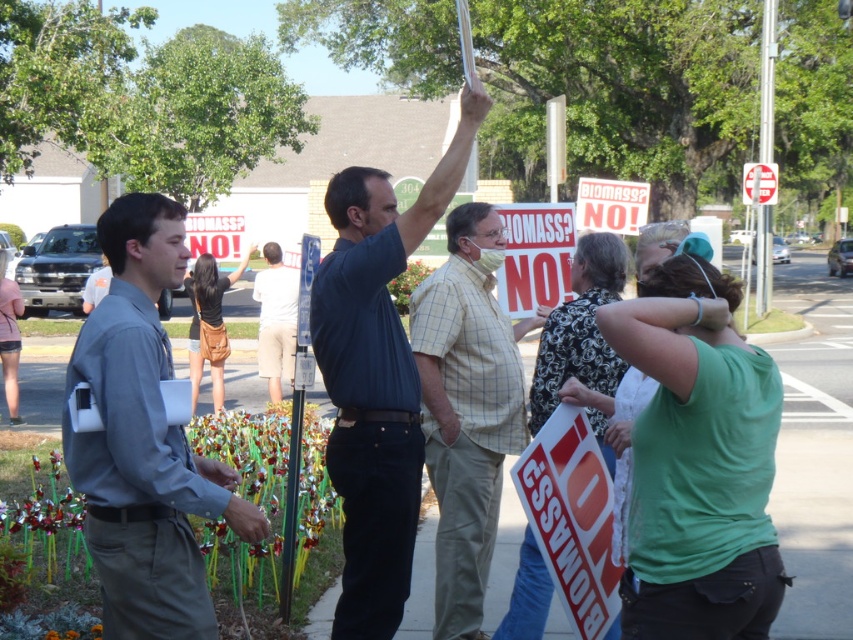
Between point (119, 380) and point (494, 344), which one is positioned in front?

Point (119, 380) is in front.

Is gray shirt at left above light brown plaid shirt at center?

Yes, gray shirt at left is above light brown plaid shirt at center.

I want to click on gray shirt at left, so click(x=144, y=440).

You are a GUI agent. You are given a task and a screenshot of the screen. Output one action in this format:
    pyautogui.click(x=<x>, y=<y>)
    Task: Click on the gray shirt at left
    This screenshot has height=640, width=853.
    Given the screenshot: What is the action you would take?
    coord(144,440)

Can you confirm if gray shirt at left is positioned below white cotton shorts at center?

Yes.

Is point (158, 608) behind point (297, 300)?

No, (158, 608) is in front of (297, 300).

Find the location of `gray shirt at left`. gray shirt at left is located at coordinates (144, 440).

Who is positioned more to the left, light brown plaid shirt at center or white cotton shorts at center?

From the viewer's perspective, white cotton shorts at center appears more on the left side.

Does point (479, 292) come farther from viewer compared to point (274, 400)?

No, (479, 292) is in front of (274, 400).

The image size is (853, 640). I want to click on light brown plaid shirt at center, so click(x=467, y=408).